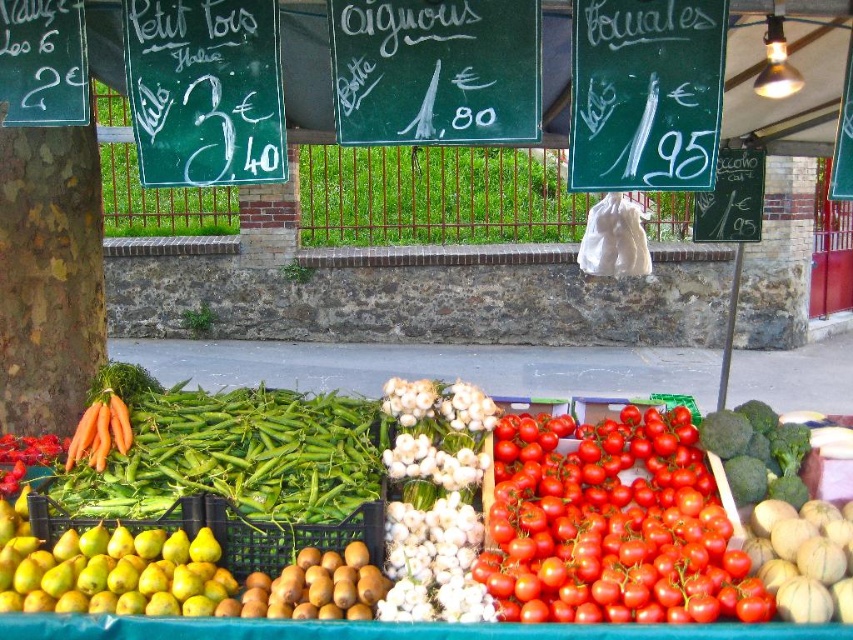
What do you see at coordinates (268, 531) in the screenshot? I see `green glossy beans at center` at bounding box center [268, 531].

Who is positioned more to the right, green glossy beans at center or yellow matte pears at lower left?

Positioned to the right is green glossy beans at center.

Is point (288, 552) less distant than point (88, 545)?

No, it is not.

Identify the location of green glossy beans at center. Image resolution: width=853 pixels, height=640 pixels. (268, 531).

Can you confirm if shiny red tomatoes at center is positioned to the left of yellow matte pears at lower left?

In fact, shiny red tomatoes at center is to the right of yellow matte pears at lower left.

Between shiny red tomatoes at center and yellow matte pears at lower left, which one is positioned higher?

shiny red tomatoes at center is above.

Is point (653, 410) positioned after point (15, 554)?

Yes, point (653, 410) is farther from viewer.

The width and height of the screenshot is (853, 640). What are the coordinates of `shiny red tomatoes at center` in the screenshot? It's located at (612, 525).

Is green glossy beans at center to the left of green chalkboard sign at center from the viewer's perspective?

No, green glossy beans at center is not to the left of green chalkboard sign at center.

Is point (788, 548) in front of point (527, 64)?

No.

Where is `green glossy beans at center`? The image size is (853, 640). green glossy beans at center is located at coordinates (268, 531).